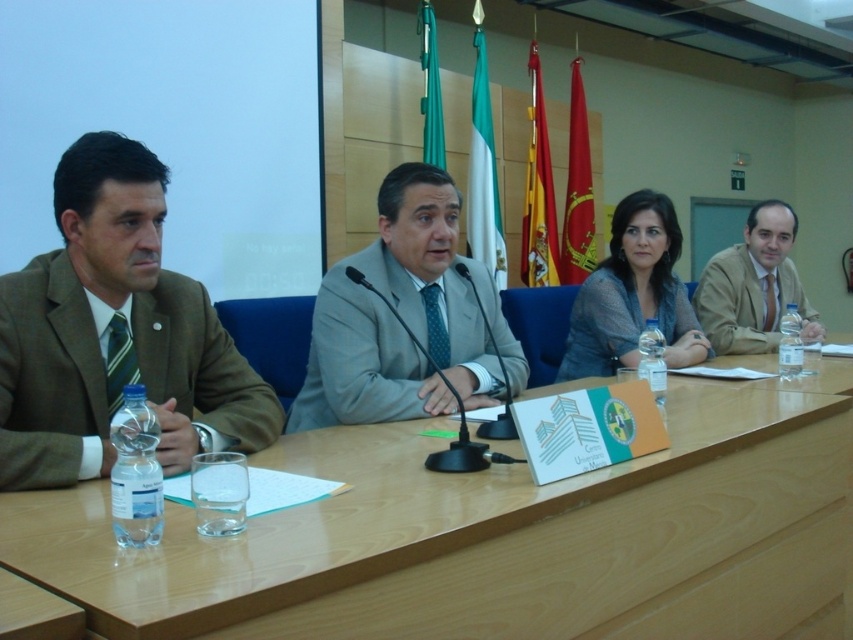
You are attending a formal meeting and need to place a laptop on the wooden table at center. However, there is a brown woolen suit at left on the table. Can you place the laptop there without moving the suit?

The wooden table at center is positioned under the brown woolen suit at left, meaning the suit is likely on the table. Therefore, you cannot place the laptop there without moving the suit.

Looking at this image, you are a guest entering the conference room and need to sit at the wooden table at center. However, there is a gray textured sweater at center on the table. What should you do before sitting?

The wooden table at center is shorter than the gray textured sweater at center, so you should move the gray textured sweater at center from the table before sitting down to ensure there is enough space.

Based on the scene description, can you determine if the wooden table at center is wider than the brown woolen suit at left?

Yes, the wooden table at center is wider than the brown woolen suit at left because the description states that the wooden table at center surpasses the brown woolen suit at left in width.